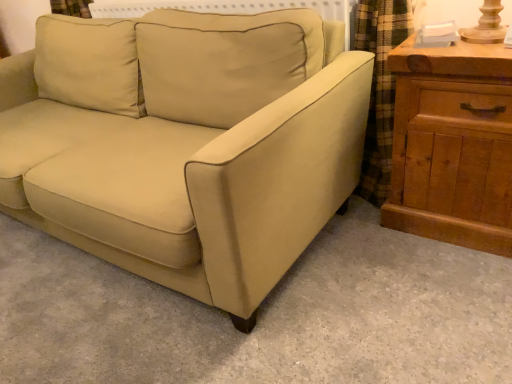
Identify the location of free space between wooden chest of drawers at right and beige fabric couch at center. This screenshot has width=512, height=384. (379, 276).